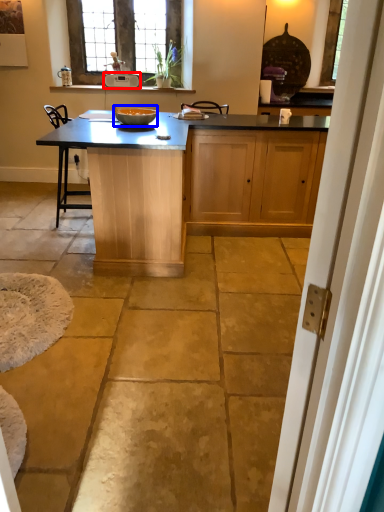
Question: Which object appears farthest to the camera in this image, appliance (highlighted by a red box) or bowl (highlighted by a blue box)?

Choices:
 (A) appliance
 (B) bowl

Answer: (A)